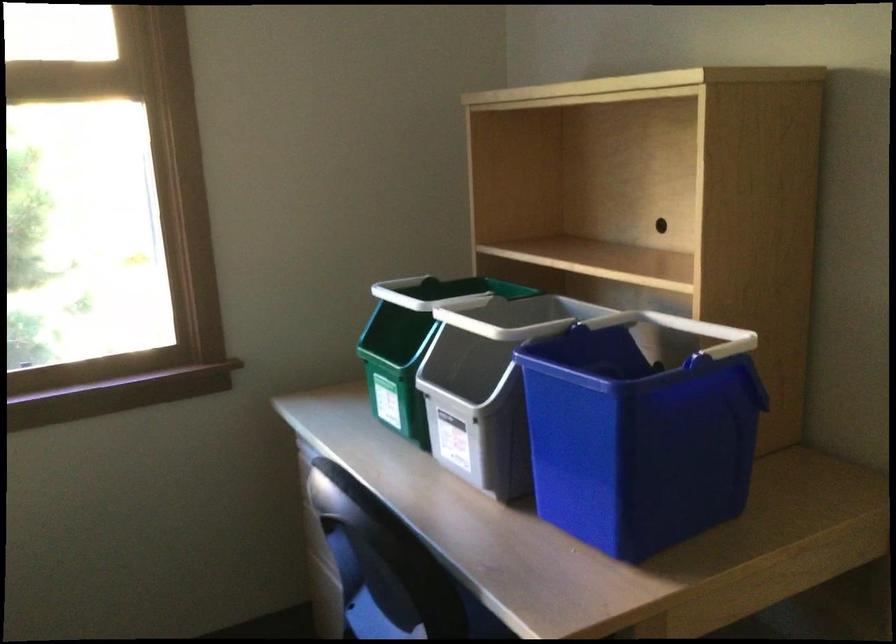
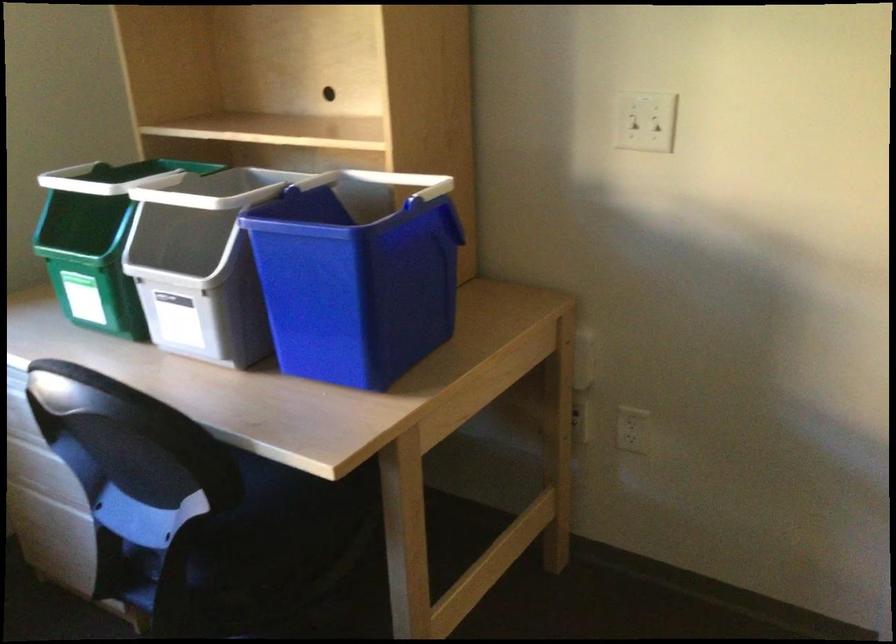
Where in the second image is the point corresponding to (x=549, y=310) from the first image?

(245, 185)